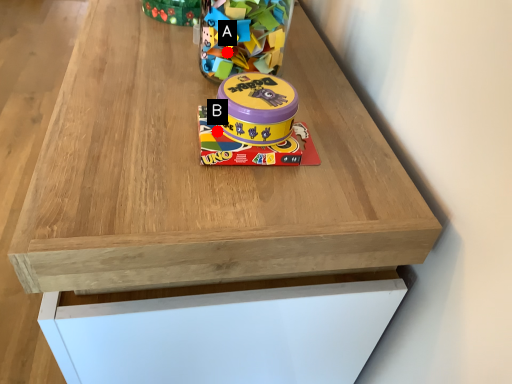
Question: Two points are circled on the image, labeled by A and B beside each circle. Among these points, which one is nearest to the camera?

Choices:
 (A) A is closer
 (B) B is closer

Answer: (B)